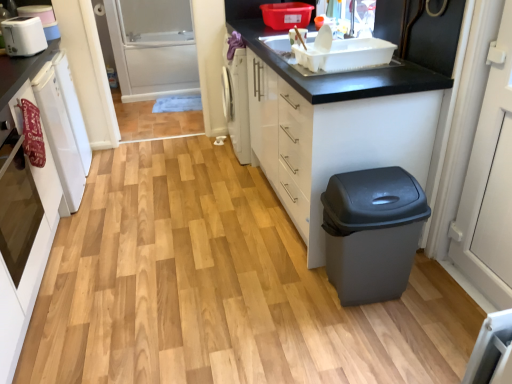
This screenshot has height=384, width=512. In order to click on vacant area situated to the left side of matte gray plastic trash can at lower right in this screenshot , I will do 296,296.